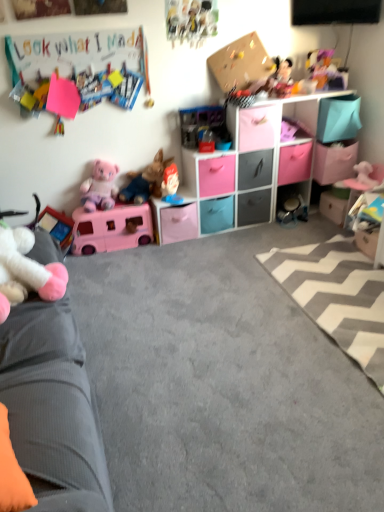
Question: Is matte plastic storage unit at upper center facing towards matte pink plastic camper at lower left, the third toy in the left-to-right sequence?

Choices:
 (A) yes
 (B) no

Answer: (B)

Question: From the image's perspective, is matte plastic storage unit at upper center located beneath matte pink plastic camper at lower left, the 7th toy viewed from the right?

Choices:
 (A) yes
 (B) no

Answer: (B)

Question: Is matte plastic storage unit at upper center not near matte pink plastic camper at lower left, the 7th toy viewed from the right?

Choices:
 (A) yes
 (B) no

Answer: (B)

Question: Could matte pink plastic camper at lower left, the 7th toy viewed from the right, be considered to be inside matte plastic storage unit at upper center?

Choices:
 (A) yes
 (B) no

Answer: (B)

Question: Considering the relative sizes of matte plastic storage unit at upper center and matte pink plastic camper at lower left, the 7th toy viewed from the right, in the image provided, is matte plastic storage unit at upper center thinner than matte pink plastic camper at lower left, the 7th toy viewed from the right,?

Choices:
 (A) no
 (B) yes

Answer: (A)

Question: Can you confirm if matte plastic storage unit at upper center is wider than matte pink plastic camper at lower left, the third toy in the left-to-right sequence?

Choices:
 (A) no
 (B) yes

Answer: (B)

Question: From a real-world perspective, is matte gray drawer at center, which is counted as the fifth drawer, starting from the left, under matte pink plastic camper at lower left, the 7th toy viewed from the right?

Choices:
 (A) no
 (B) yes

Answer: (A)

Question: Is matte gray drawer at center, which is counted as the fifth drawer, starting from the left, smaller than matte pink plastic camper at lower left, the 7th toy viewed from the right?

Choices:
 (A) no
 (B) yes

Answer: (B)

Question: Is matte gray drawer at center, which is counted as the fifth drawer, starting from the left, thinner than matte pink plastic camper at lower left, the third toy in the left-to-right sequence?

Choices:
 (A) no
 (B) yes

Answer: (A)

Question: From the image's perspective, is matte gray drawer at center, which is the 3th drawer from right to left, over matte pink plastic camper at lower left, the 7th toy viewed from the right?

Choices:
 (A) yes
 (B) no

Answer: (A)

Question: From a real-world perspective, does matte gray drawer at center, which is counted as the fifth drawer, starting from the left, stand above matte pink plastic camper at lower left, the third toy in the left-to-right sequence?

Choices:
 (A) no
 (B) yes

Answer: (B)

Question: Can you confirm if matte gray drawer at center, which is the 3th drawer from right to left, is bigger than matte pink plastic camper at lower left, the third toy in the left-to-right sequence?

Choices:
 (A) no
 (B) yes

Answer: (A)

Question: Is cartoonish paper poster at upper center, which is counted as the sixth toy, starting from the left, turned away from white plush toy at left, the first toy positioned from the left?

Choices:
 (A) no
 (B) yes

Answer: (A)